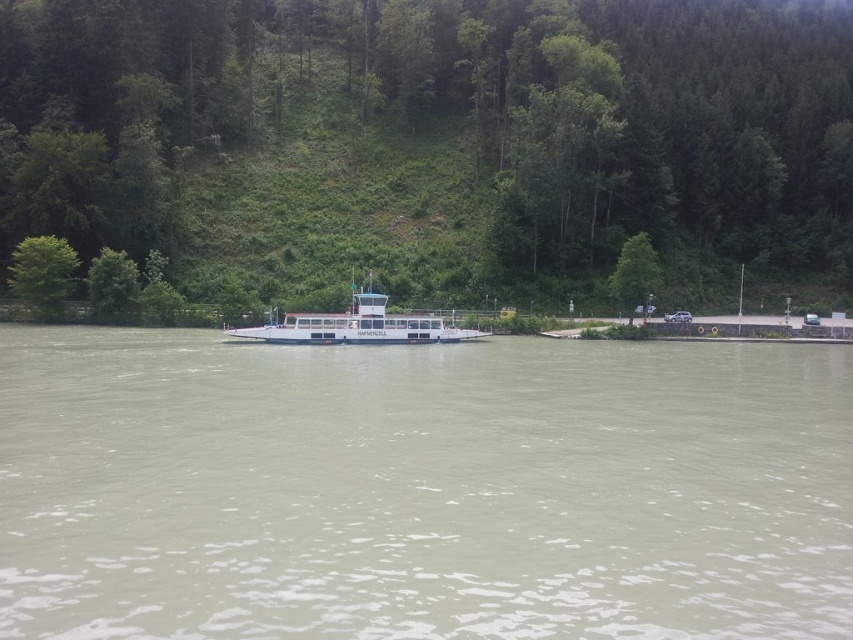
Who is more distant from viewer, (683,276) or (16,276)?

The point (683,276) is more distant.

Can you confirm if green leafy tree at center is bigger than green leafy tree at upper left?

Correct, green leafy tree at center is larger in size than green leafy tree at upper left.

This screenshot has height=640, width=853. Identify the location of green leafy tree at center. (436, 145).

Is white glossy boat at center thinner than green leafy tree at right?

No.

Identify the location of white glossy boat at center. pos(357,324).

Who is positioned more to the left, green leafy tree at center or white glossy boat at center?

Positioned to the left is white glossy boat at center.

Which is behind, point (303, 172) or point (405, 323)?

The point (303, 172) is behind.

Locate an element on the screen. green leafy tree at center is located at coordinates (436, 145).